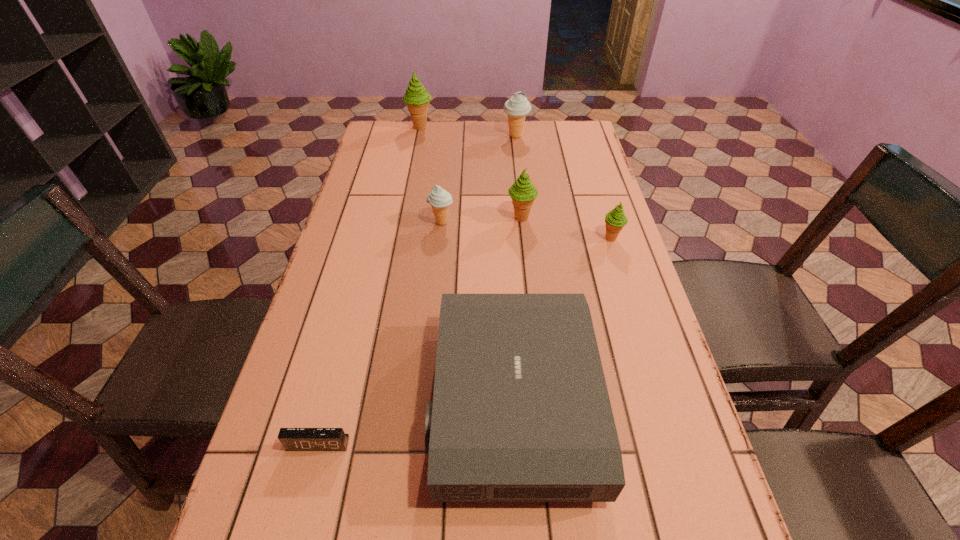
Locate an element on the screen. free space between the farther beige icecream and the fifth farthest object is located at coordinates (564, 187).

Identify the location of vacant space that's between the rightmost object and the left beige icecream. The width and height of the screenshot is (960, 540). (526, 231).

This screenshot has height=540, width=960. Identify the location of free space between the projector and the leftmost icecream. (467, 265).

I want to click on free space between the second smallest green icecream and the left beige icecream, so click(481, 220).

Locate which object is the fifth closest to the projector. Please provide its 2D coordinates. Your answer should be formatted as a tuple, i.e. [(x, y)], where the tuple contains the x and y coordinates of a point satisfying the conditions above.

[(517, 107)]

Select which object appears as the fifth closest to the projector. Please provide its 2D coordinates. Your answer should be formatted as a tuple, i.e. [(x, y)], where the tuple contains the x and y coordinates of a point satisfying the conditions above.

[(517, 107)]

The image size is (960, 540). What are the coordinates of `icecream object that ranks as the fourth closest to the second green icecream from left to right` in the screenshot? It's located at (416, 97).

Identify which icecream is the fourth closest to the alarm clock. Please provide its 2D coordinates. Your answer should be formatted as a tuple, i.e. [(x, y)], where the tuple contains the x and y coordinates of a point satisfying the conditions above.

[(517, 107)]

Where is `green icecream that is the second nearest to the farther beige icecream`? This screenshot has width=960, height=540. green icecream that is the second nearest to the farther beige icecream is located at coordinates (523, 192).

Select which green icecream is the closest to the rightmost object. Please provide its 2D coordinates. Your answer should be formatted as a tuple, i.e. [(x, y)], where the tuple contains the x and y coordinates of a point satisfying the conditions above.

[(523, 192)]